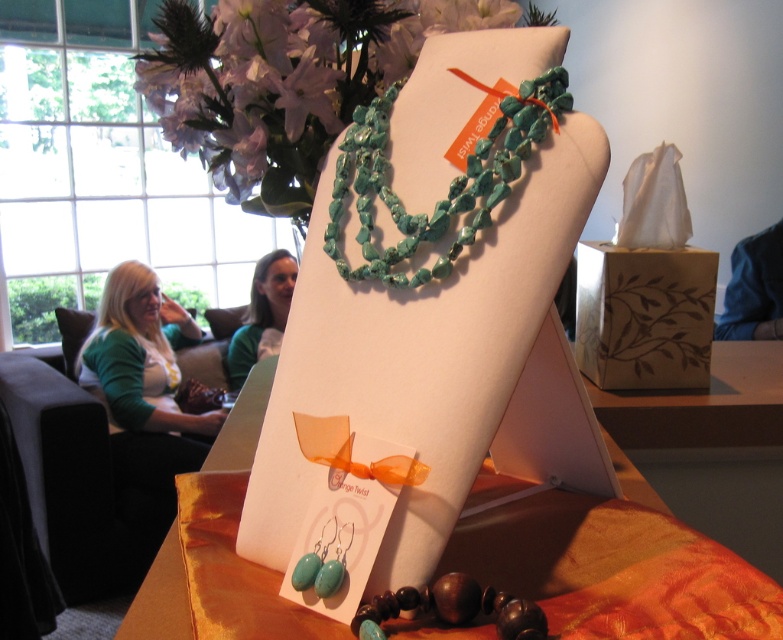
Question: Can you confirm if silky purple petals at upper center is positioned to the right of orange silk table at center?

Choices:
 (A) no
 (B) yes

Answer: (A)

Question: Is orange silk table at center behind turquoise stone necklace at center?

Choices:
 (A) yes
 (B) no

Answer: (B)

Question: Estimate the real-world distances between objects in this image. Which object is farther from the green fabric at left?

Choices:
 (A) turquoise stone necklace at center
 (B) silky purple petals at upper center
 (C) green jersey at left
 (D) orange silk table at center

Answer: (A)

Question: Which of the following is the farthest from the observer?

Choices:
 (A) click(x=442, y=276)
 (B) click(x=247, y=317)
 (C) click(x=760, y=627)
 (D) click(x=116, y=282)

Answer: (B)

Question: Which object is positioned farthest from the orange silk table at center?

Choices:
 (A) turquoise stone necklace at center
 (B) green jersey at left
 (C) silky purple petals at upper center

Answer: (B)

Question: Can you confirm if silky purple petals at upper center is positioned above green jersey at left?

Choices:
 (A) no
 (B) yes

Answer: (B)